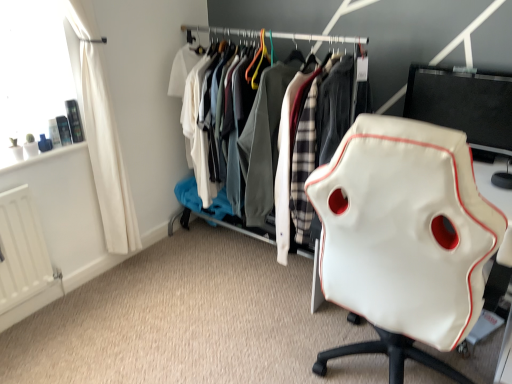
Question: Does white leather chair at right appear on the left side of white leather jacket at center?

Choices:
 (A) yes
 (B) no

Answer: (B)

Question: Would you say white leather jacket at center is part of white leather chair at right's contents?

Choices:
 (A) yes
 (B) no

Answer: (B)

Question: From the image's perspective, is white leather chair at right over white leather jacket at center?

Choices:
 (A) no
 (B) yes

Answer: (A)

Question: Is white leather chair at right wider than white leather jacket at center?

Choices:
 (A) yes
 (B) no

Answer: (A)

Question: Is white leather chair at right positioned in front of white leather jacket at center?

Choices:
 (A) no
 (B) yes

Answer: (B)

Question: Is black glossy monitor at upper right bigger or smaller than white matte radiator at lower left?

Choices:
 (A) small
 (B) big

Answer: (B)

Question: From the image's perspective, is black glossy monitor at upper right located above or below white matte radiator at lower left?

Choices:
 (A) above
 (B) below

Answer: (A)

Question: From a real-world perspective, is black glossy monitor at upper right positioned above or below white matte radiator at lower left?

Choices:
 (A) below
 (B) above

Answer: (B)

Question: Is black glossy monitor at upper right in front of or behind white matte radiator at lower left in the image?

Choices:
 (A) front
 (B) behind

Answer: (A)

Question: Based on their positions, is white leather jacket at center located to the left or right of white fabric curtain at left?

Choices:
 (A) left
 (B) right

Answer: (B)

Question: In the image, is white leather jacket at center positioned in front of or behind white fabric curtain at left?

Choices:
 (A) front
 (B) behind

Answer: (B)

Question: Considering the positions of white leather jacket at center and white fabric curtain at left in the image, is white leather jacket at center taller or shorter than white fabric curtain at left?

Choices:
 (A) tall
 (B) short

Answer: (B)

Question: From the image's perspective, is white leather jacket at center located above or below white fabric curtain at left?

Choices:
 (A) above
 (B) below

Answer: (A)

Question: In terms of height, does black glossy monitor at upper right look taller or shorter compared to white leather chair at right?

Choices:
 (A) short
 (B) tall

Answer: (A)

Question: Considering the relative positions of black glossy monitor at upper right and white leather chair at right in the image provided, is black glossy monitor at upper right to the left or to the right of white leather chair at right?

Choices:
 (A) right
 (B) left

Answer: (A)